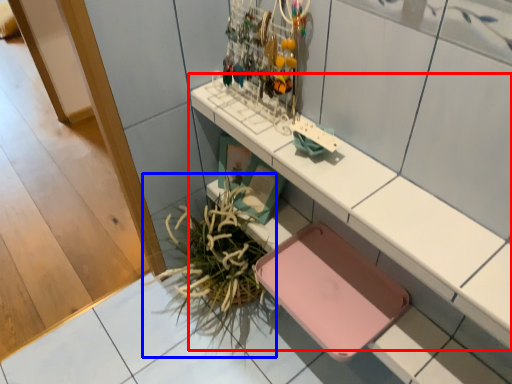
Question: Which point is closer to the camera, shelf (highlighted by a red box) or plant (highlighted by a blue box)?

Choices:
 (A) shelf
 (B) plant

Answer: (A)